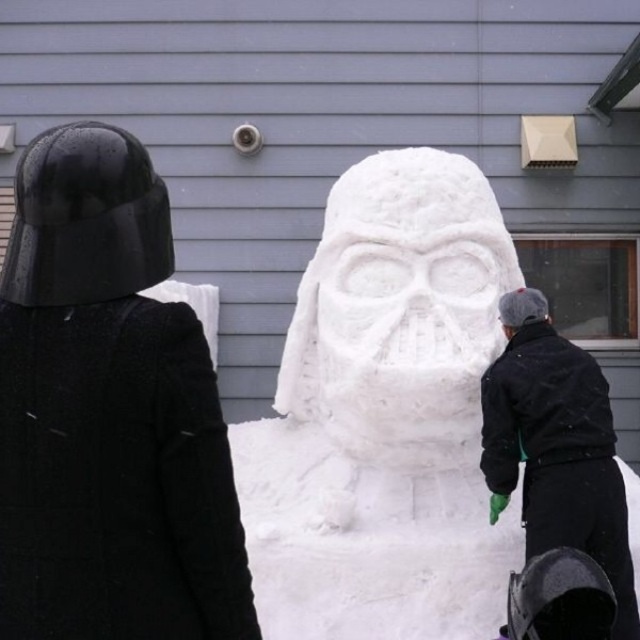
Is point (388, 484) positioned after point (609, 560)?

Yes, it is.

In the scene shown: Is white fluffy snowman at center to the left of black matte jacket at lower right from the viewer's perspective?

Yes, white fluffy snowman at center is to the left of black matte jacket at lower right.

This screenshot has height=640, width=640. What do you see at coordinates (384, 416) in the screenshot?
I see `white fluffy snowman at center` at bounding box center [384, 416].

This screenshot has height=640, width=640. In order to click on white fluffy snowman at center in this screenshot , I will do `click(384, 416)`.